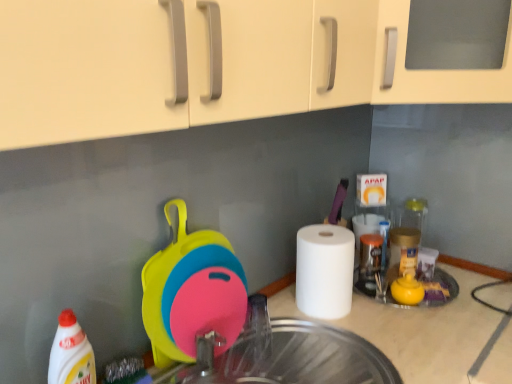
At what (x,y) coordinates should I click in order to perform the action: click on free point in front of metallic silver faucet at center. Please return your answer as a coordinate pair (x, y). The height and width of the screenshot is (384, 512). Looking at the image, I should click on (264, 369).